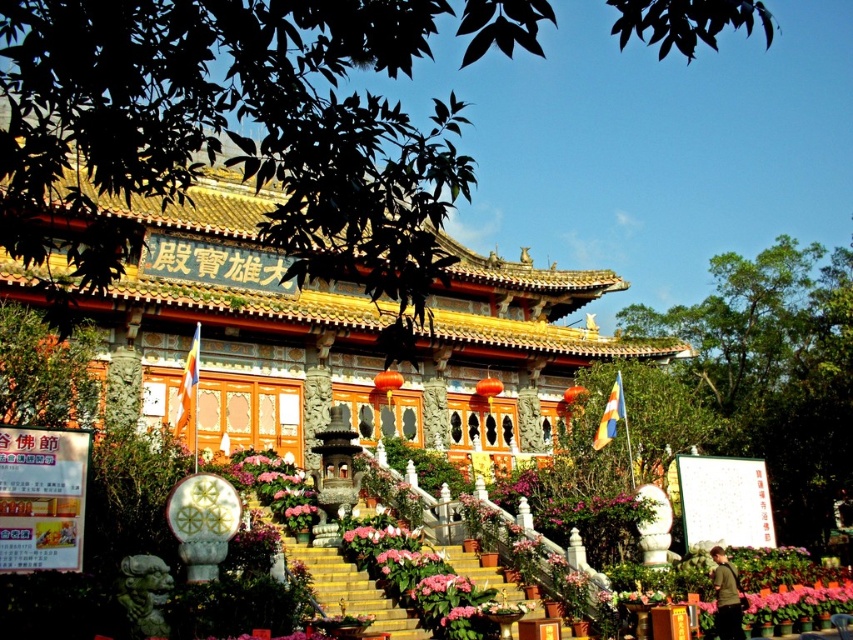
You are standing at the bottom of the steps leading to the golden ornate palace at center and the pink matte flower at center. Which object is positioned higher from the ground?

The golden ornate palace at center is above the pink matte flower at center, so it is positioned higher from the ground.

You are standing at the base of the steps leading to the golden ornate palace at center. You want to place a 40 meter long banner between you and the palace. Will the banner fit without overlapping either the steps or the palace?

The distance between you and the golden ornate palace at center is 43.06 meters. Since the banner is 40 meters long, it will fit between you and the palace without overlapping either the steps or the palace.